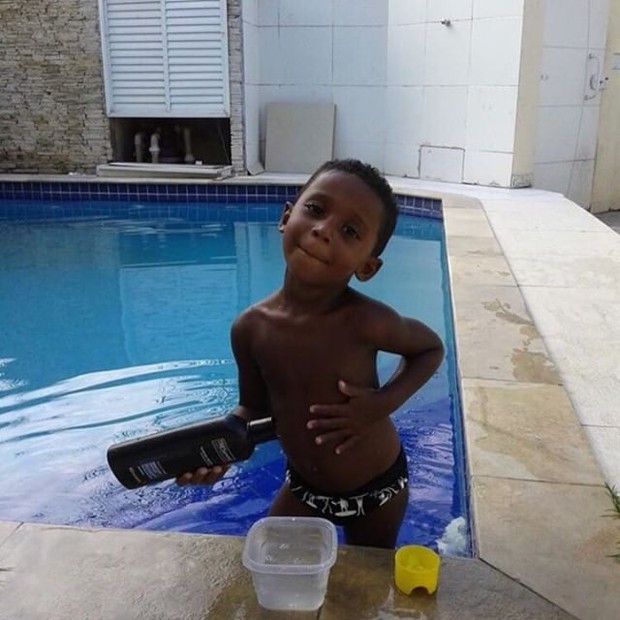
This screenshot has height=620, width=620. Find the location of `plastic container`. plastic container is located at coordinates (284, 578).